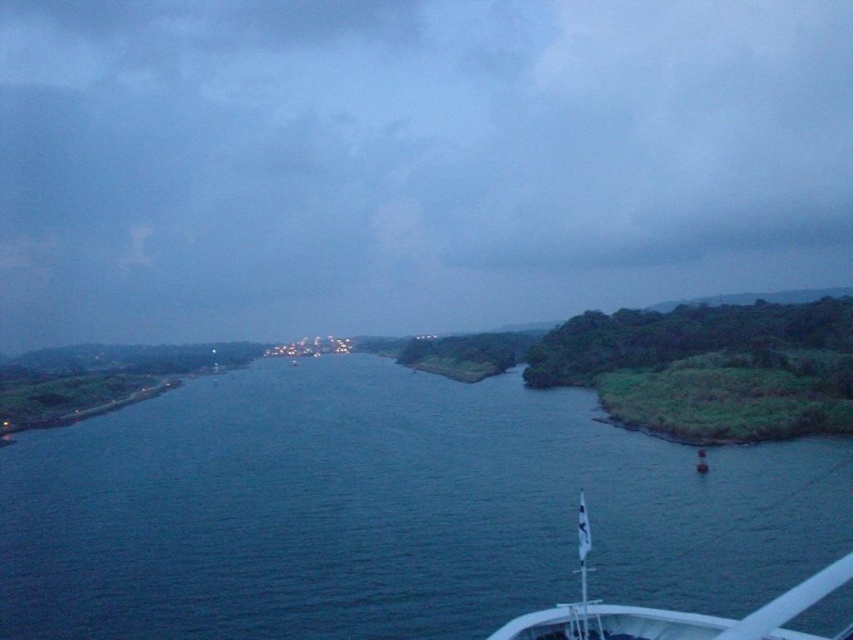
Measure the distance from dark blue water at center to white matte boat at lower right.

The distance of dark blue water at center from white matte boat at lower right is 22.62 meters.

Is point (222, 561) more distant than point (692, 630)?

That is True.

I want to click on dark blue water at center, so click(387, 509).